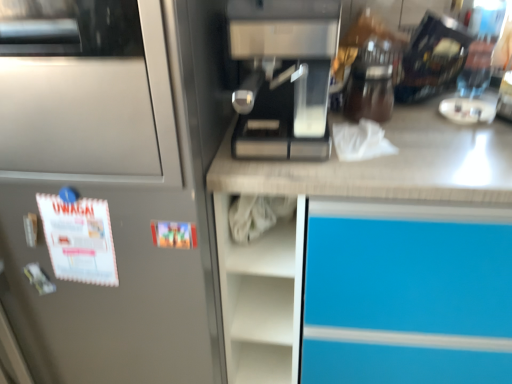
Locate an element on the screen. black glossy coffee maker at upper right is located at coordinates (432, 58).

From a real-world perspective, is black glossy coffee maker at upper right on top of sleek metallic coffee machine at center?

No, from a real-world perspective, black glossy coffee maker at upper right is not over sleek metallic coffee machine at center

Who is smaller, black glossy coffee maker at upper right or sleek metallic coffee machine at center?

Smaller between the two is black glossy coffee maker at upper right.

Between black glossy coffee maker at upper right and sleek metallic coffee machine at center, which one has more height?

sleek metallic coffee machine at center is taller.

Is sleek metallic coffee machine at center with black glossy coffee maker at upper right?

sleek metallic coffee machine at center and black glossy coffee maker at upper right are clearly separated.

From a real-world perspective, is sleek metallic coffee machine at center on top of black glossy coffee maker at upper right?

Indeed, from a real-world perspective, sleek metallic coffee machine at center stands above black glossy coffee maker at upper right.

Which is closer, [257,63] or [405,71]?

Point [257,63] is closer to the camera than point [405,71].

From the picture: Between sleek metallic coffee machine at center and black glossy coffee maker at upper right, which one appears on the left side from the viewer's perspective?

Positioned to the left is sleek metallic coffee machine at center.

What's the angular difference between sleek metallic coffee machine at center and satin silver refrigerator at left's facing directions?

2.63e-05 degrees separate the facing orientations of sleek metallic coffee machine at center and satin silver refrigerator at left.

Between sleek metallic coffee machine at center and satin silver refrigerator at left, which one has smaller size?

sleek metallic coffee machine at center is smaller.

Is satin silver refrigerator at left at the back of sleek metallic coffee machine at center?

sleek metallic coffee machine at center is not turned away from satin silver refrigerator at left.

Considering the positions of point (228, 1) and point (207, 357), is point (228, 1) closer or farther from the camera than point (207, 357)?

Point (228, 1) appears to be closer to the viewer than point (207, 357).

From the image's perspective, who appears lower, black glossy coffee maker at upper right or satin silver refrigerator at left?

satin silver refrigerator at left is shown below in the image.

Is black glossy coffee maker at upper right in contact with satin silver refrigerator at left?

black glossy coffee maker at upper right and satin silver refrigerator at left are clearly separated.

Can we say black glossy coffee maker at upper right lies outside satin silver refrigerator at left?

Yes, black glossy coffee maker at upper right is outside of satin silver refrigerator at left.

Based on their sizes in the image, would you say satin silver refrigerator at left is bigger or smaller than black glossy coffee maker at upper right?

satin silver refrigerator at left is bigger than black glossy coffee maker at upper right.

Between satin silver refrigerator at left and black glossy coffee maker at upper right, which one is positioned in front?

Positioned in front is satin silver refrigerator at left.

Based on their positions, is satin silver refrigerator at left located to the left or right of black glossy coffee maker at upper right?

satin silver refrigerator at left is to the left of black glossy coffee maker at upper right.

Based on their positions, is satin silver refrigerator at left located to the left or right of sleek metallic coffee machine at center?

satin silver refrigerator at left is to the left of sleek metallic coffee machine at center.

How far apart are satin silver refrigerator at left and sleek metallic coffee machine at center?

satin silver refrigerator at left and sleek metallic coffee machine at center are 10.64 inches apart.

In the scene shown: Could you tell me if satin silver refrigerator at left is facing sleek metallic coffee machine at center?

No, satin silver refrigerator at left does not turn towards sleek metallic coffee machine at center.

Looking at this image, is satin silver refrigerator at left inside or outside of sleek metallic coffee machine at center?

satin silver refrigerator at left is not enclosed by sleek metallic coffee machine at center.

You are a GUI agent. You are given a task and a screenshot of the screen. Output one action in this format:
    pyautogui.click(x=<x>, y=<y>)
    Task: Click on the kitchen appliance lying below the black glossy coffee maker at upper right (from the image's perspective)
    
    Given the screenshot: What is the action you would take?
    pyautogui.click(x=283, y=76)

Where is `appliance that is on the right side of sleek metallic coffee machine at center`? This screenshot has height=384, width=512. appliance that is on the right side of sleek metallic coffee machine at center is located at coordinates (432, 58).

When comparing their distances from satin silver refrigerator at left, does sleek metallic coffee machine at center or black glossy coffee maker at upper right seem closer?

sleek metallic coffee machine at center lies closer to satin silver refrigerator at left than the other object.

From the image, which object appears to be nearer to black glossy coffee maker at upper right, satin silver refrigerator at left or sleek metallic coffee machine at center?

sleek metallic coffee machine at center is closer to black glossy coffee maker at upper right.

Estimate the real-world distances between objects in this image. Which object is further from sleek metallic coffee machine at center, black glossy coffee maker at upper right or satin silver refrigerator at left?

Among the two, black glossy coffee maker at upper right is located further to sleek metallic coffee machine at center.

From the image, which object appears to be nearer to black glossy coffee maker at upper right, sleek metallic coffee machine at center or satin silver refrigerator at left?

sleek metallic coffee machine at center is closer to black glossy coffee maker at upper right.

Which object lies further to the anchor point satin silver refrigerator at left, black glossy coffee maker at upper right or sleek metallic coffee machine at center?

black glossy coffee maker at upper right is positioned further to the anchor satin silver refrigerator at left.

When comparing their distances from sleek metallic coffee machine at center, does satin silver refrigerator at left or black glossy coffee maker at upper right seem further?

black glossy coffee maker at upper right is further to sleek metallic coffee machine at center.

Locate an element on the screen. This screenshot has width=512, height=384. kitchen appliance located between satin silver refrigerator at left and black glossy coffee maker at upper right in the left-right direction is located at coordinates (283, 76).